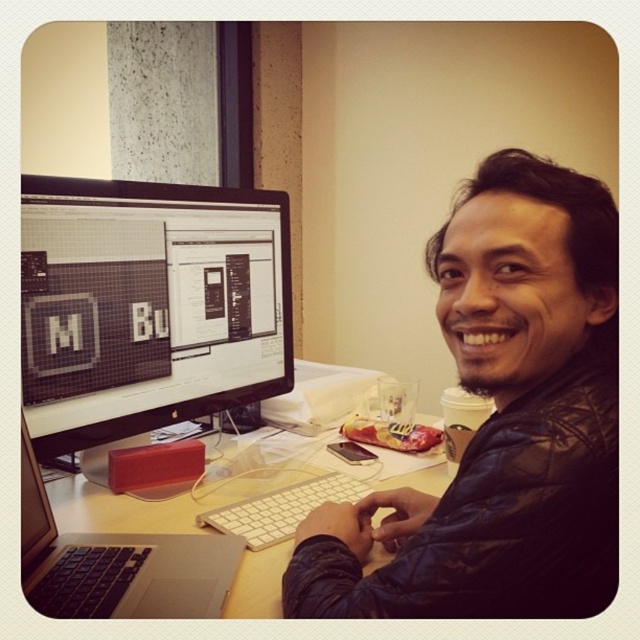
You are taking a photo of the desk and want to focus on both the point at (115, 506) and the point at (115, 554). Which point is closer to the camera?

Point at (115, 506) is closer to the camera than point at (115, 554).

Based on the photo, you are a delivery person who needs to place a small package on the desk without moving any items. The package requires a space of 10cm x 10cm. Given the coordinates of the silver metallic laptop at lower left, can you determine if there is enough space on the desk to place the package?

The silver metallic laptop at lower left is positioned at coordinates point (116, 564). However, without knowing the dimensions of the desk or the exact positions of other items, it is impossible to determine if there is sufficient space for the package. Please check the desk layout for available space.

You are standing in front of the desk and want to reach the leather jacket at center. Can you estimate whether it is within arm s length? Assume your arm length is 24 inches.

The leather jacket at center is 19.56 inches from viewer, which is within the arm length of 24 inches. So yes, it is within reach.